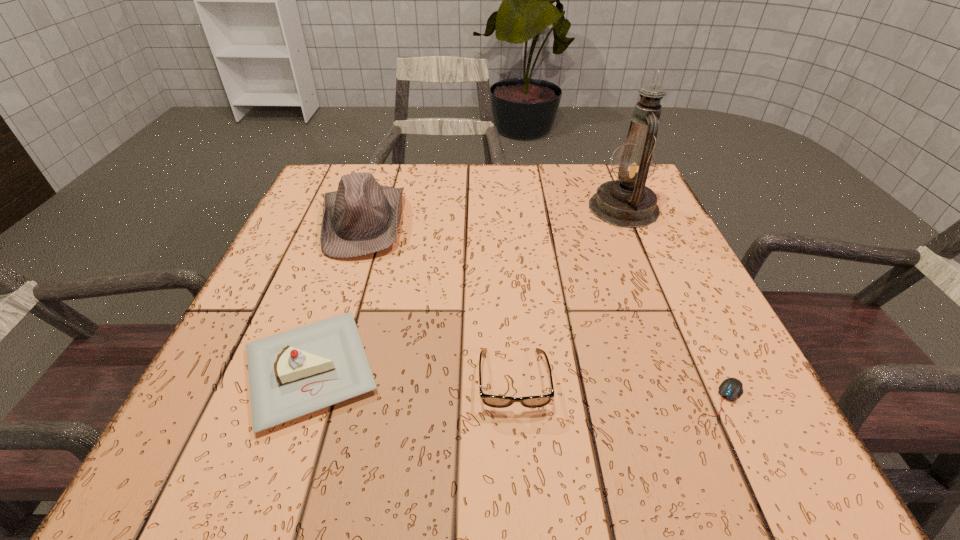
In order to click on vacant area in the image that satisfies the following two spatial constraints: 1. on the front side of the cake; 2. on the right side of the mouse in this screenshot , I will do `click(300, 399)`.